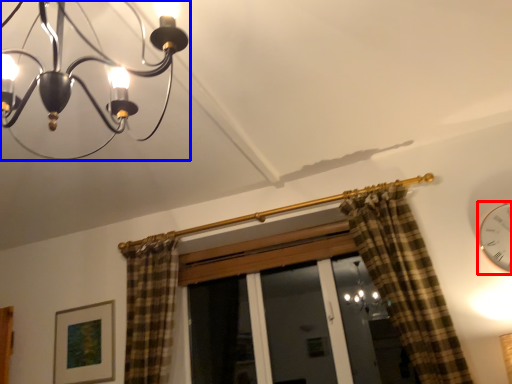
Question: Which point is closer to the camera, clock (highlighted by a red box) or lamp (highlighted by a blue box)?

Choices:
 (A) clock
 (B) lamp

Answer: (B)